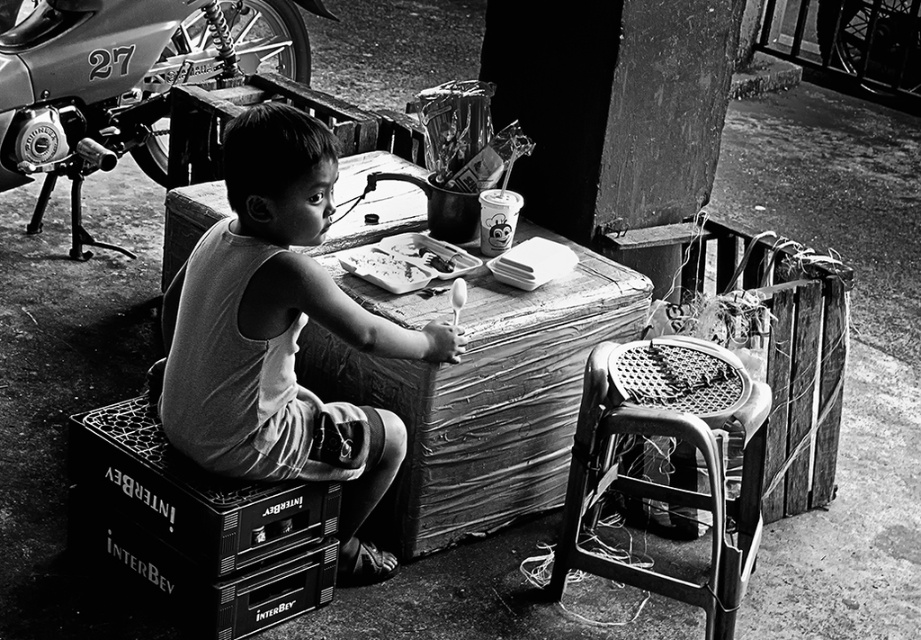
Does smooth cotton shirt at center have a larger size compared to black plastic box at lower left?

Yes.

Measure the distance between smooth cotton shirt at center and black plastic box at lower left.

The distance of smooth cotton shirt at center from black plastic box at lower left is 14.09 inches.

What are the coordinates of `smooth cotton shirt at center` in the screenshot? It's located at (281, 336).

Is smooth cotton shirt at center below rusty metal stool at lower right?

Incorrect, smooth cotton shirt at center is not positioned below rusty metal stool at lower right.

Does smooth cotton shirt at center appear on the left side of rusty metal stool at lower right?

Yes, smooth cotton shirt at center is to the left of rusty metal stool at lower right.

The image size is (921, 640). I want to click on smooth cotton shirt at center, so click(281, 336).

Find the location of a particular element. smooth cotton shirt at center is located at coordinates (281, 336).

Who is taller, metallic silver motorbike at left or rusty metal stool at lower right?

metallic silver motorbike at left

Is point (27, 177) positioned before point (744, 372)?

No.

The image size is (921, 640). I want to click on metallic silver motorbike at left, so click(x=125, y=83).